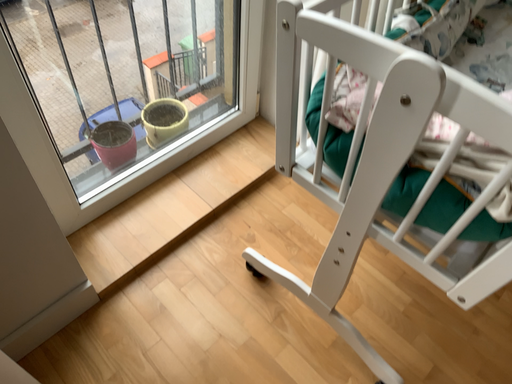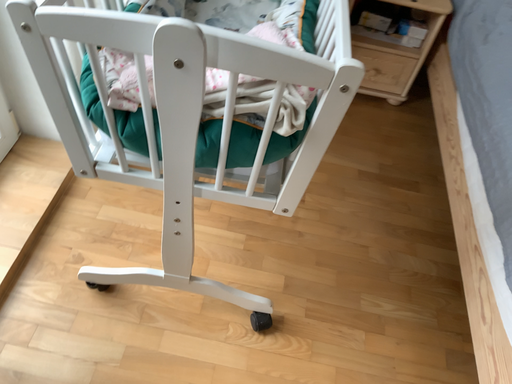
Question: How did the camera likely rotate when shooting the video?

Choices:
 (A) rotated right
 (B) rotated left

Answer: (A)